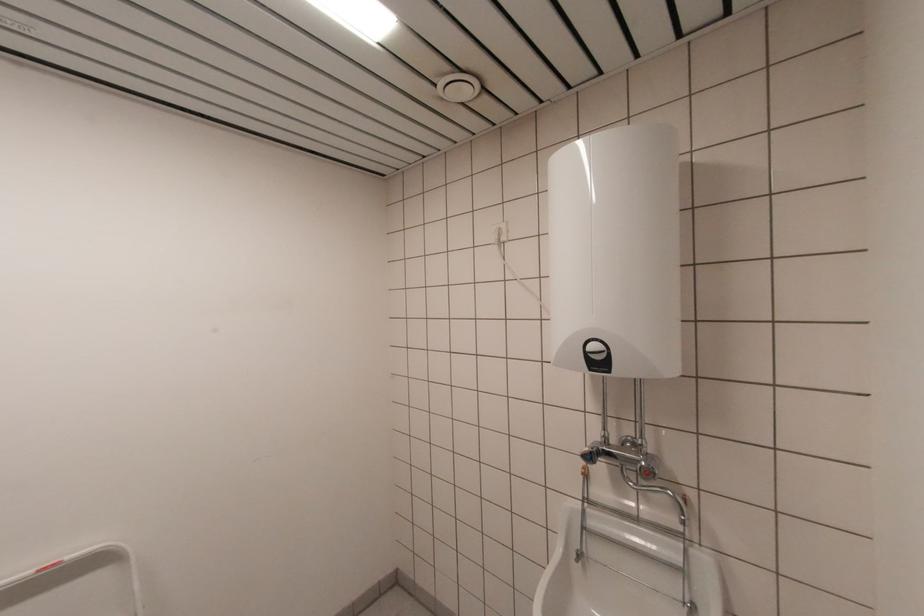
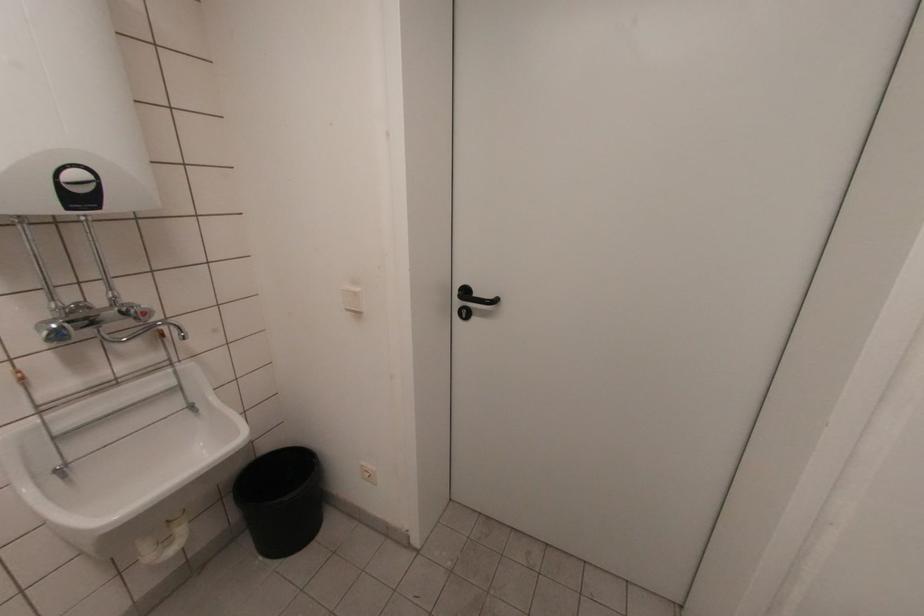
The images are taken continuously from a first-person perspective. In which direction is your viewpoint rotating?

The camera rotated toward right-down.